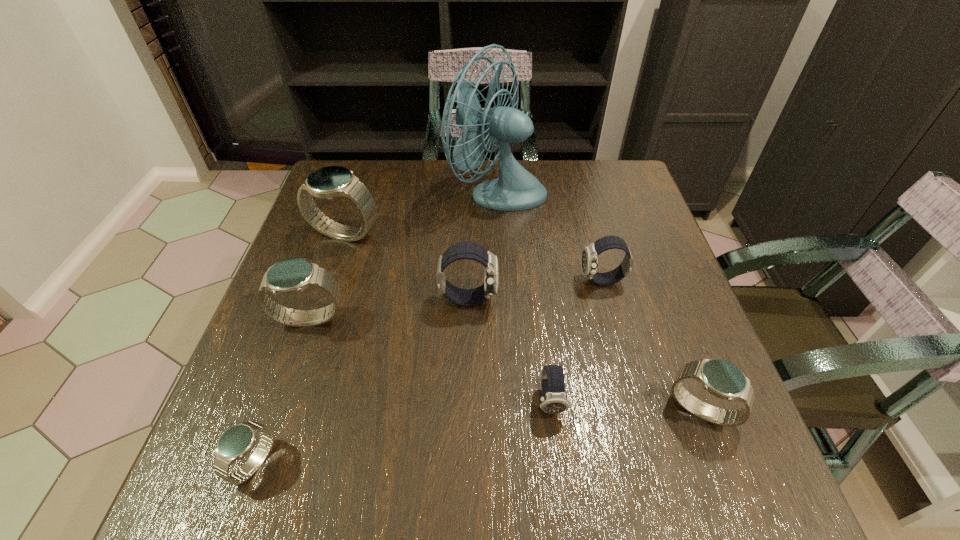
You are a GUI agent. You are given a task and a screenshot of the screen. Output one action in this format:
    pyautogui.click(x=<x>, y=<y>)
    Task: Click on the smallest dark watch
    Image resolution: width=960 pixels, height=540 pixels.
    Given the screenshot: What is the action you would take?
    pyautogui.click(x=554, y=400)

Where is `the second dark watch from right to left`? the second dark watch from right to left is located at coordinates (554, 400).

Image resolution: width=960 pixels, height=540 pixels. I want to click on the smallest blue watch, so click(x=237, y=441).

Identify the location of vacant space located 0.100m in front of the fan to blow air. (413, 191).

You are a GUI agent. You are given a task and a screenshot of the screen. Output one action in this format:
    pyautogui.click(x=<x>, y=<y>)
    Task: Click on the vacant space located in front of the fan to blow air
    The image size is (960, 540).
    Given the screenshot: What is the action you would take?
    pyautogui.click(x=406, y=191)

Where is `free region located 0.350m in front of the fan to blow air`? This screenshot has height=540, width=960. free region located 0.350m in front of the fan to blow air is located at coordinates (324, 191).

Identify the location of vacant space located 0.370m on the front of the farthest watch. This screenshot has width=960, height=540. (297, 381).

This screenshot has width=960, height=540. What are the coordinates of `free spot located 0.200m on the face of the fourth watch from left to right` in the screenshot? It's located at (588, 299).

Where is `vacant space positioned 0.210m on the back of the second biggest blue watch`? The image size is (960, 540). vacant space positioned 0.210m on the back of the second biggest blue watch is located at coordinates (337, 240).

Where is `blank space located 0.050m on the face of the second smallest dark watch`? blank space located 0.050m on the face of the second smallest dark watch is located at coordinates (558, 281).